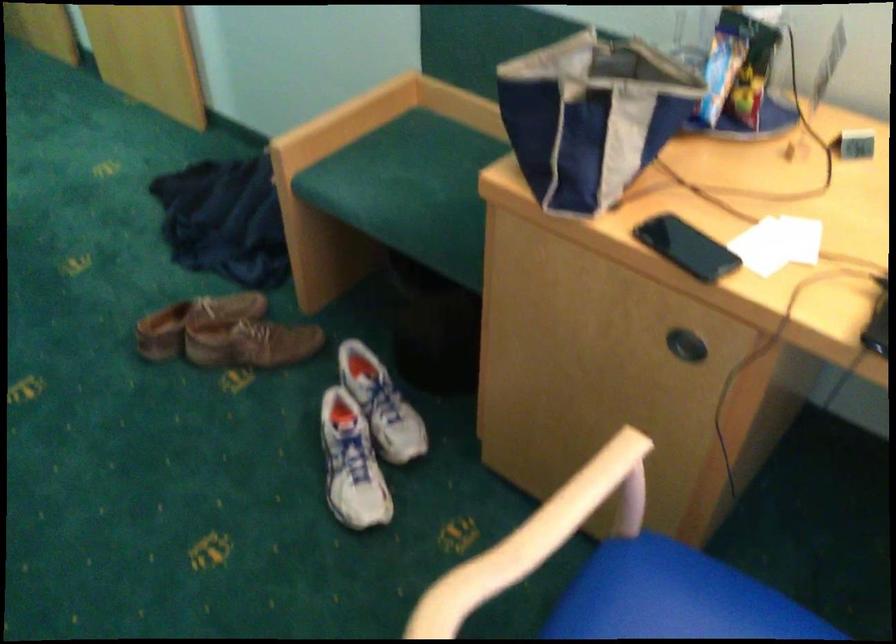
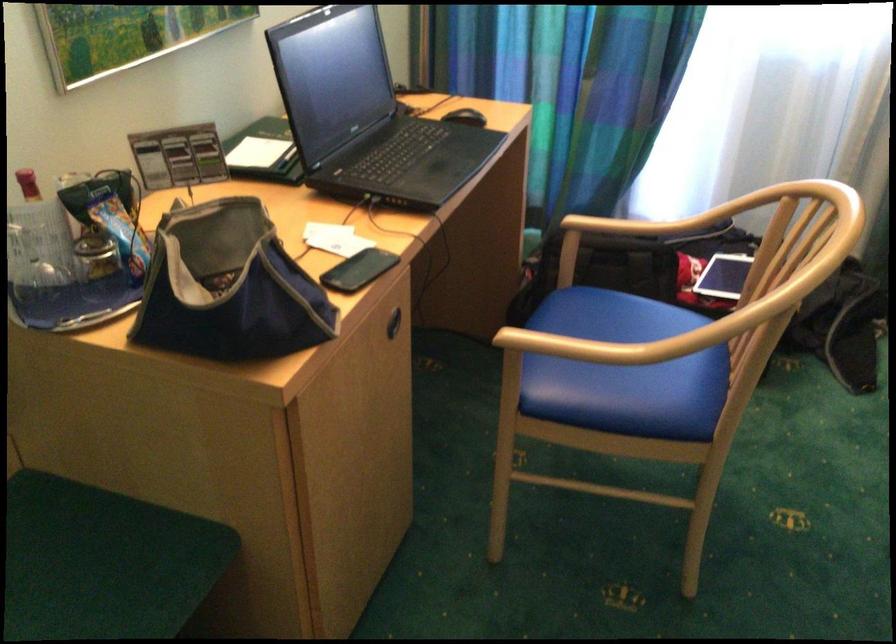
The point at (531, 91) is marked in the first image. Where is the corresponding point in the second image?

(228, 287)